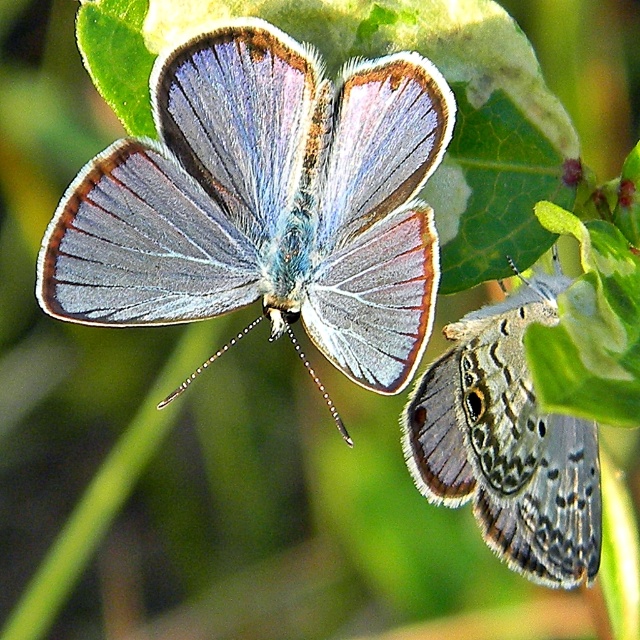
Between matte blue wings at center and translucent gray wings at lower right, which one has less height?

translucent gray wings at lower right is shorter.

Where is `matte blue wings at center`? matte blue wings at center is located at coordinates (266, 204).